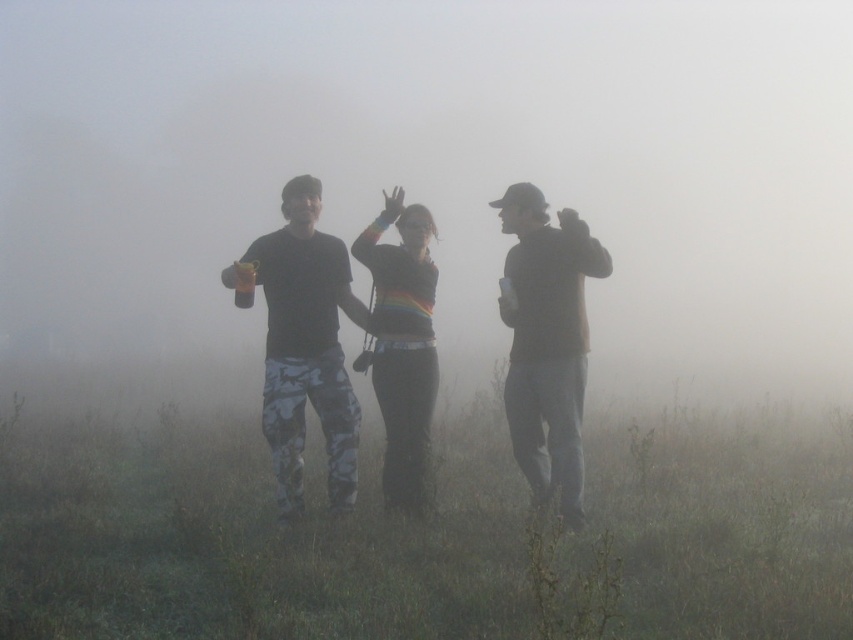
Who is higher up, green grass at center or camouflage pants at center?

Positioned higher is camouflage pants at center.

What are the coordinates of `green grass at center` in the screenshot? It's located at (424, 534).

Which is behind, point (839, 529) or point (334, 291)?

Positioned behind is point (334, 291).

Identify the location of green grass at center. This screenshot has height=640, width=853. (424, 534).

Can you confirm if foggy atmosphere at center is positioned to the left of camouflage pants at center?

Yes, foggy atmosphere at center is to the left of camouflage pants at center.

Can you confirm if foggy atmosphere at center is positioned to the right of camouflage pants at center?

In fact, foggy atmosphere at center is to the left of camouflage pants at center.

Image resolution: width=853 pixels, height=640 pixels. Find the location of `foggy atmosphere at center`. foggy atmosphere at center is located at coordinates (440, 170).

Between matte brown sweater at right and rainbow striped sweater at center, which one has less height?

rainbow striped sweater at center

Does matte brown sweater at right lie behind rainbow striped sweater at center?

That is False.

The image size is (853, 640). What are the coordinates of `matte brown sweater at right` in the screenshot? It's located at (547, 342).